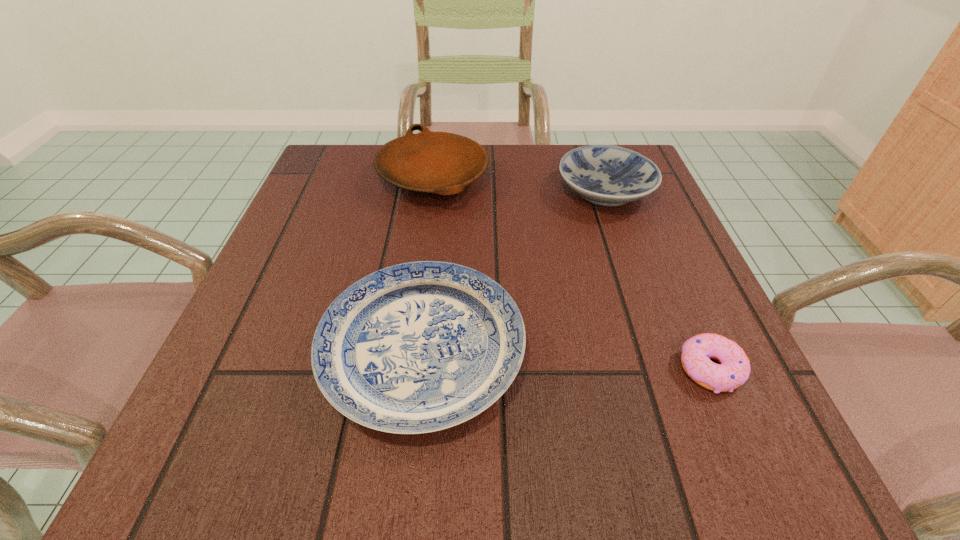
Locate an element on the screen. object that is at the near left corner is located at coordinates (418, 347).

Where is `object that is at the far right corner`? The width and height of the screenshot is (960, 540). object that is at the far right corner is located at coordinates (607, 175).

The width and height of the screenshot is (960, 540). What are the coordinates of `free space at the far edge` in the screenshot? It's located at (544, 168).

Locate an element on the screen. This screenshot has height=540, width=960. blank area at the near edge is located at coordinates (543, 474).

At what (x,y) coordinates should I click in order to perform the action: click on free location at the left edge of the desktop. Please return your answer as a coordinate pair (x, y). Looking at the image, I should click on (349, 234).

Find the location of `vacant space at the right edge of the desktop`. vacant space at the right edge of the desktop is located at coordinates (637, 269).

This screenshot has width=960, height=540. In the image, there is a desktop. Identify the location of free space at the near left corner. (190, 428).

This screenshot has width=960, height=540. In the image, there is a desktop. In order to click on vacant region at the far right corner in this screenshot , I will do `click(572, 145)`.

At what (x,y) coordinates should I click in order to perform the action: click on free area in between the doughnut and the rightmost plate. Please return your answer as a coordinate pair (x, y). This screenshot has width=960, height=540. Looking at the image, I should click on (658, 280).

Identify the location of empty location between the nearest plate and the doughnut. The width and height of the screenshot is (960, 540). (566, 360).